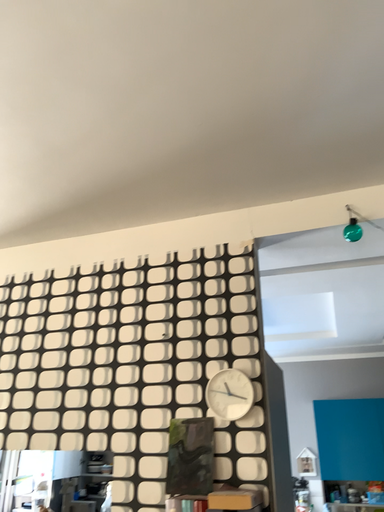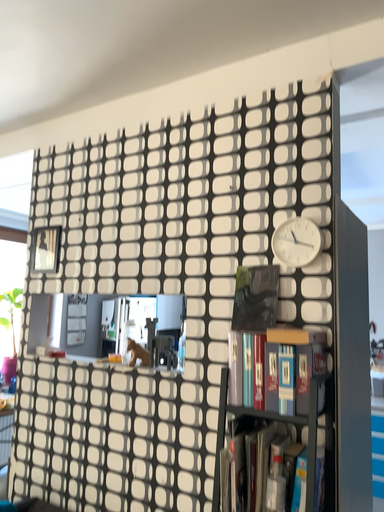
Question: Which way did the camera rotate in the video?

Choices:
 (A) rotated upward
 (B) rotated downward

Answer: (B)